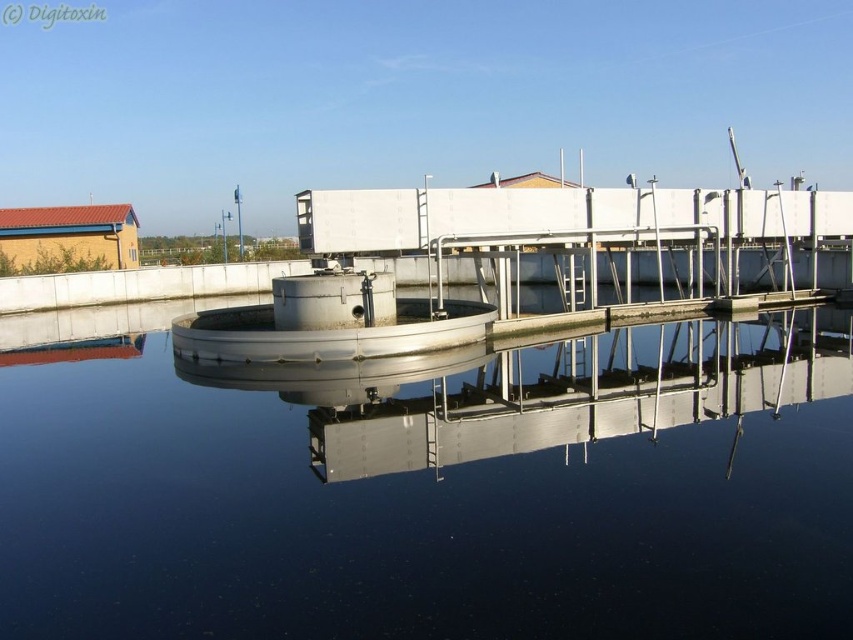
You are an engineer inspecting the water treatment facility. You notice the metallic water at center and the metallic silver platform at center. Which object is positioned lower in the image?

The metallic water at center is located below the metallic silver platform at center, so it is positioned lower in the image.

Based on the scene description, where is the metallic water at center located in the image?

The metallic water at center is located at point coordinates of (x=428, y=486).

In the scene shown: You are an engineer inspecting the water treatment facility. You notice the metallic water at center and the metallic silver platform at center. Which one has a larger surface area?

The metallic water at center has a larger surface area than the metallic silver platform at center because it is bigger.